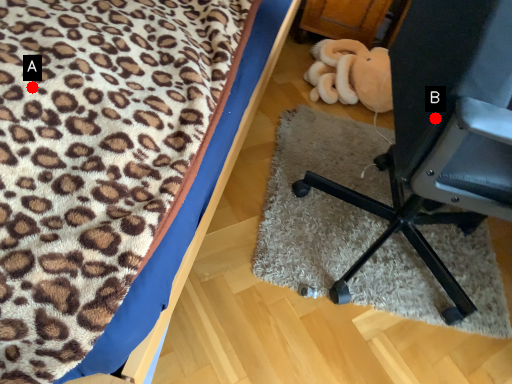
Question: Two points are circled on the image, labeled by A and B beside each circle. Which point appears closest to the camera in this image?

Choices:
 (A) A is closer
 (B) B is closer

Answer: (A)